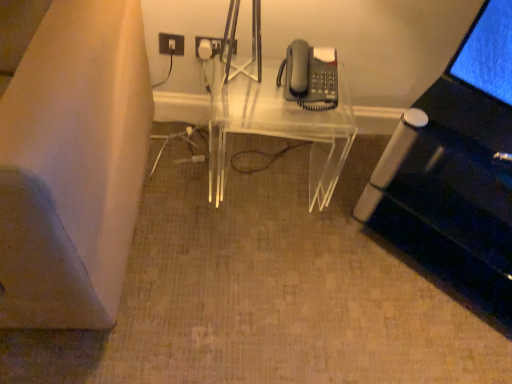
The image size is (512, 384). In order to click on matte gray phone at upper right in this screenshot , I will do `click(310, 75)`.

Based on their sizes in the image, would you say matte gray phone at upper right is bigger or smaller than transparent acrylic table at center?

Considering their sizes, matte gray phone at upper right takes up less space than transparent acrylic table at center.

From the image's perspective, relative to transparent acrylic table at center, is matte gray phone at upper right above or below?

matte gray phone at upper right is above transparent acrylic table at center.

Is matte gray phone at upper right at the left side of transparent acrylic table at center?

Incorrect, matte gray phone at upper right is not on the left side of transparent acrylic table at center.

Which is behind, matte gray phone at upper right or transparent acrylic table at center?

transparent acrylic table at center is more distant.

Looking at this image, between transparent acrylic table at center and matte gray phone at upper right, which one has larger width?

transparent acrylic table at center is wider.

Is point (225, 105) closer to viewer compared to point (332, 65)?

No, it is behind (332, 65).

In the image, is transparent acrylic table at center positioned in front of or behind matte gray phone at upper right?

Clearly, transparent acrylic table at center is behind matte gray phone at upper right.

Measure the distance between transparent acrylic table at center and matte gray phone at upper right.

transparent acrylic table at center is 6.53 inches from matte gray phone at upper right.

From a real-world perspective, between white plastic electrical outlet at upper center and matte gray phone at upper right, who is vertically lower?

white plastic electrical outlet at upper center, from a real-world perspective.

Would you consider white plastic electrical outlet at upper center to be distant from matte gray phone at upper right?

No, white plastic electrical outlet at upper center is not far from matte gray phone at upper right.

Who is more distant, white plastic electrical outlet at upper center or matte gray phone at upper right?

white plastic electrical outlet at upper center is more distant.

Measure the distance between white plastic electrical outlet at upper center and matte gray phone at upper right.

white plastic electrical outlet at upper center is 19.93 inches from matte gray phone at upper right.

From the picture: Does transparent acrylic table at center touch white plastic electrical outlet at upper center?

There is a gap between transparent acrylic table at center and white plastic electrical outlet at upper center.

Does point (224, 130) appear closer or farther from the camera than point (170, 38)?

Point (224, 130) is closer to the camera than point (170, 38).

Considering the positions of objects transparent acrylic table at center and white plastic electrical outlet at upper center in the image provided, who is behind, transparent acrylic table at center or white plastic electrical outlet at upper center?

white plastic electrical outlet at upper center.

From the image's perspective, is transparent acrylic table at center above or below white plastic electrical outlet at upper center?

Based on their image positions, transparent acrylic table at center is located beneath white plastic electrical outlet at upper center.

Can you confirm if white plastic electrical outlet at upper center is positioned to the right of transparent acrylic table at center?

No, white plastic electrical outlet at upper center is not to the right of transparent acrylic table at center.

Choose the correct answer: Is white plastic electrical outlet at upper center inside transparent acrylic table at center or outside it?

white plastic electrical outlet at upper center lies outside transparent acrylic table at center.

Considering the sizes of objects white plastic electrical outlet at upper center and transparent acrylic table at center in the image provided, who is shorter, white plastic electrical outlet at upper center or transparent acrylic table at center?

With less height is white plastic electrical outlet at upper center.

Could you tell me if matte gray phone at upper right is turned towards white plastic electrical outlet at upper center?

No, matte gray phone at upper right is not facing towards white plastic electrical outlet at upper center.

Considering the relative sizes of matte gray phone at upper right and white plastic electrical outlet at upper center in the image provided, is matte gray phone at upper right wider than white plastic electrical outlet at upper center?

Yes.

From the image's perspective, is matte gray phone at upper right above or below white plastic electrical outlet at upper center?

matte gray phone at upper right is situated lower than white plastic electrical outlet at upper center in the image.

The width and height of the screenshot is (512, 384). Find the location of `corded phone above the white plastic electrical outlet at upper center (from a real-world perspective)`. corded phone above the white plastic electrical outlet at upper center (from a real-world perspective) is located at coordinates tap(310, 75).

Image resolution: width=512 pixels, height=384 pixels. What are the coordinates of `corded phone above the transparent acrylic table at center (from a real-world perspective)` in the screenshot? It's located at (310, 75).

Where is `corded phone that appears on the right of transparent acrylic table at center`? corded phone that appears on the right of transparent acrylic table at center is located at coordinates (310, 75).

Considering their positions, is matte gray phone at upper right positioned further to transparent acrylic table at center than white plastic electrical outlet at upper center?

white plastic electrical outlet at upper center is further to transparent acrylic table at center.

Estimate the real-world distances between objects in this image. Which object is further from white plastic electrical outlet at upper center, transparent acrylic table at center or matte gray phone at upper right?

matte gray phone at upper right is further to white plastic electrical outlet at upper center.

From the image, which object appears to be farther from transparent acrylic table at center, white plastic electrical outlet at upper center or matte gray phone at upper right?

Among the two, white plastic electrical outlet at upper center is located further to transparent acrylic table at center.

When comparing their distances from matte gray phone at upper right, does white plastic electrical outlet at upper center or transparent acrylic table at center seem further?

white plastic electrical outlet at upper center is positioned further to the anchor matte gray phone at upper right.

When comparing their distances from white plastic electrical outlet at upper center, does matte gray phone at upper right or transparent acrylic table at center seem further?

matte gray phone at upper right is further to white plastic electrical outlet at upper center.

From the image, which object appears to be farther from matte gray phone at upper right, transparent acrylic table at center or white plastic electrical outlet at upper center?

white plastic electrical outlet at upper center.

I want to click on table between white plastic electrical outlet at upper center and matte gray phone at upper right from left to right, so click(279, 127).